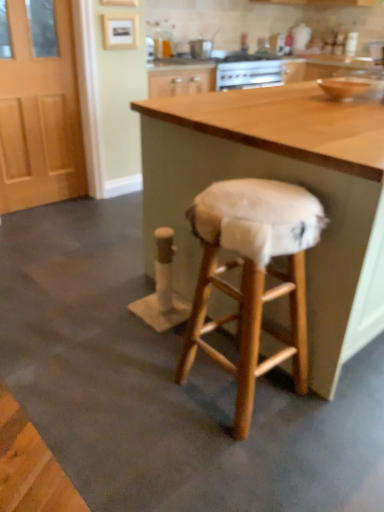
Question: Considering the positions of light brown wooden door at left and white fabric-covered stool at center in the image, is light brown wooden door at left taller or shorter than white fabric-covered stool at center?

Choices:
 (A) short
 (B) tall

Answer: (B)

Question: From the image's perspective, is light brown wooden door at left located above or below white fabric-covered stool at center?

Choices:
 (A) below
 (B) above

Answer: (B)

Question: Estimate the real-world distances between objects in this image. Which object is closer to the wooden table at center?

Choices:
 (A) white fabric-covered stool at center
 (B) light brown wooden door at left

Answer: (A)

Question: Estimate the real-world distances between objects in this image. Which object is closer to the light brown wooden door at left?

Choices:
 (A) white fabric-covered stool at center
 (B) wooden table at center

Answer: (B)